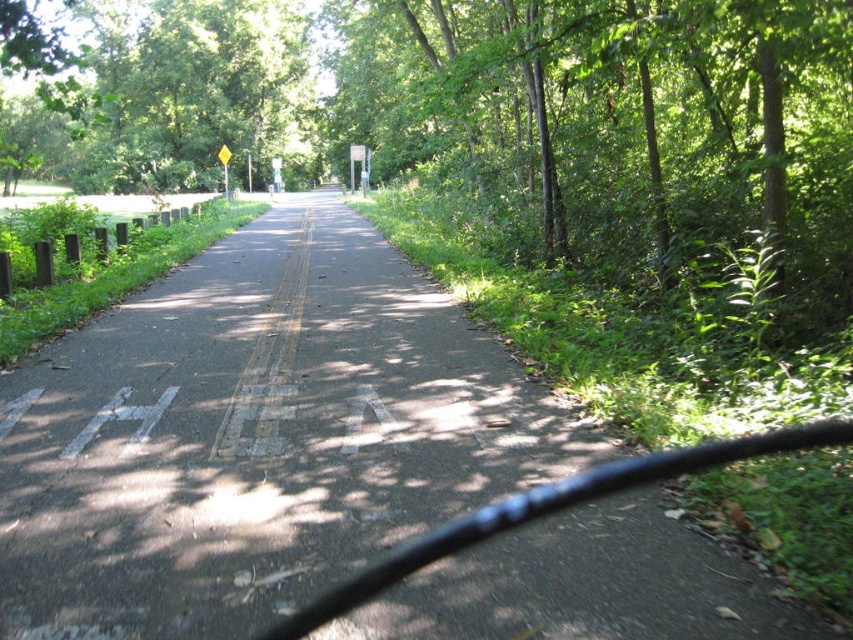
Question: Is black asphalt road at center positioned in front of green leafy tree at center?

Choices:
 (A) no
 (B) yes

Answer: (B)

Question: Which of the following is the closest to the observer?

Choices:
 (A) green leafy tree at upper left
 (B) black asphalt road at center
 (C) green leafy tree at center

Answer: (B)

Question: From the image, what is the correct spatial relationship of black asphalt road at center in relation to green leafy tree at center?

Choices:
 (A) below
 (B) above

Answer: (A)

Question: Which of the following is the farthest from the observer?

Choices:
 (A) (0, 88)
 (B) (227, 180)

Answer: (A)

Question: Which of the following is the closest to the observer?

Choices:
 (A) green leafy tree at upper left
 (B) black asphalt road at center
 (C) green leafy tree at center

Answer: (B)

Question: Does green leafy tree at upper left have a greater width compared to yellow plastic sign at center?

Choices:
 (A) no
 (B) yes

Answer: (B)